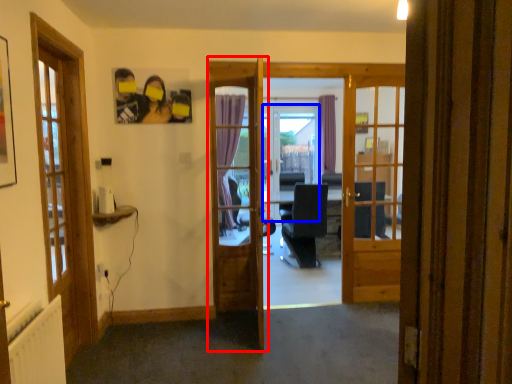
Question: Which object appears farthest to the camera in this image, door (highlighted by a red box) or screen door (highlighted by a blue box)?

Choices:
 (A) door
 (B) screen door

Answer: (B)